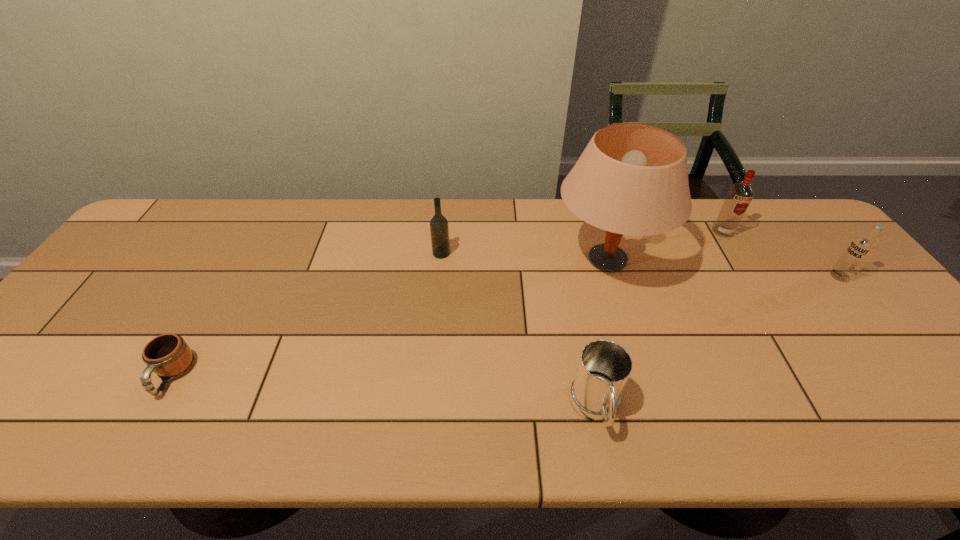
The height and width of the screenshot is (540, 960). Find the location of `the closest object relative to the rightmost object`. the closest object relative to the rightmost object is located at coordinates (740, 195).

The height and width of the screenshot is (540, 960). Find the location of `the second closest vodka to the farthest vodka`. the second closest vodka to the farthest vodka is located at coordinates (439, 230).

Identify the location of vodka that is the closest to the leftmost vodka. The height and width of the screenshot is (540, 960). (740, 195).

I want to click on vacant space that satisfies the following two spatial constraints: 1. on the front label of the nearest vodka; 2. on the side of the taller mug with the handle, so 949,409.